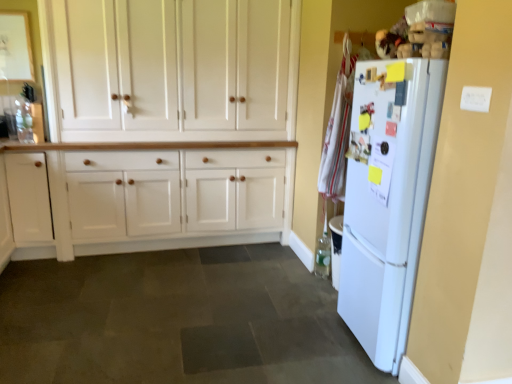
The width and height of the screenshot is (512, 384). In order to click on free point above dark gray tile floor at center (from a real-world perspective) in this screenshot , I will do `click(157, 327)`.